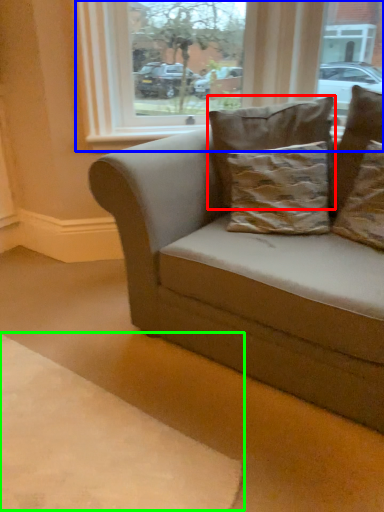
Question: Considering the real-world distances, which object is closest to pillow (highlighted by a red box)? window (highlighted by a blue box) or dog bed (highlighted by a green box).

Choices:
 (A) window
 (B) dog bed

Answer: (A)